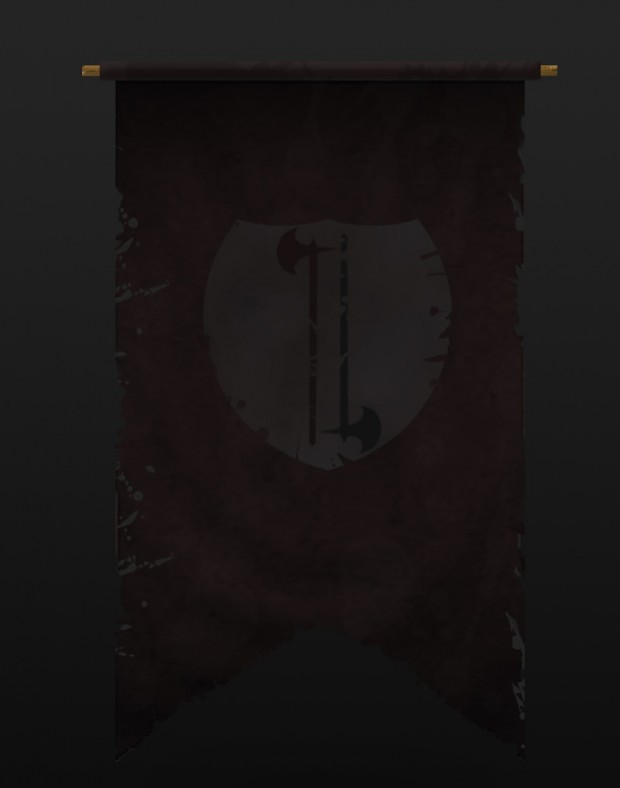
Find the location of a particular element. The width and height of the screenshot is (620, 788). wood dowel is located at coordinates (93, 69).